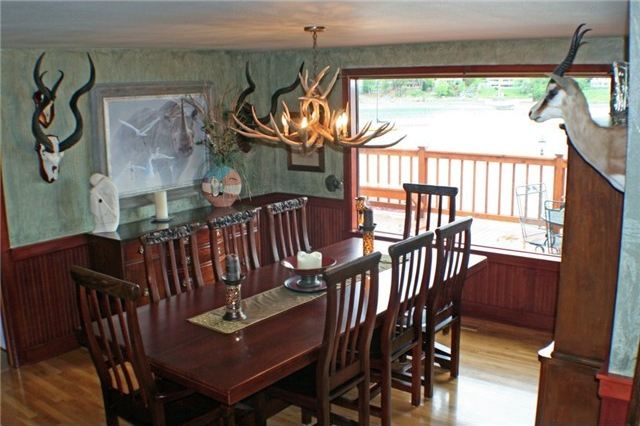
I want to click on antelope mount, so click(591, 144).